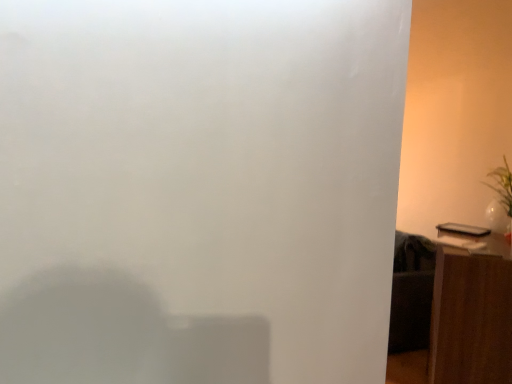
Measure the distance between brown wood side table at right and camera.

brown wood side table at right is 6.31 feet away from camera.

The width and height of the screenshot is (512, 384). What do you see at coordinates (470, 319) in the screenshot? I see `brown wood side table at right` at bounding box center [470, 319].

Find the location of a particular element. brown wood side table at right is located at coordinates (470, 319).

Image resolution: width=512 pixels, height=384 pixels. Find the location of `white glossy vase at right`. white glossy vase at right is located at coordinates (502, 185).

This screenshot has width=512, height=384. Describe the element at coordinates (502, 185) in the screenshot. I see `white glossy vase at right` at that location.

This screenshot has height=384, width=512. What are the coordinates of `brown wood side table at right` in the screenshot? It's located at (470, 319).

Considering the relative positions of brown wood side table at right and white glossy vase at right in the image provided, is brown wood side table at right to the right of white glossy vase at right from the viewer's perspective?

In fact, brown wood side table at right is to the left of white glossy vase at right.

Relative to white glossy vase at right, is brown wood side table at right in front or behind?

brown wood side table at right is positioned closer to the viewer than white glossy vase at right.

Which is farther, [447,333] or [508,206]?

The point [508,206] is farther from the camera.

From the image's perspective, who appears lower, brown wood side table at right or white glossy vase at right?

brown wood side table at right, from the image's perspective.

From a real-world perspective, who is located lower, brown wood side table at right or white glossy vase at right?

In real-world perspective, brown wood side table at right is lower.

Considering the relative sizes of brown wood side table at right and white glossy vase at right in the image provided, is brown wood side table at right thinner than white glossy vase at right?

No.

Which of these two, brown wood side table at right or white glossy vase at right, stands shorter?

With less height is white glossy vase at right.

Considering the sizes of objects brown wood side table at right and white glossy vase at right in the image provided, who is smaller, brown wood side table at right or white glossy vase at right?

white glossy vase at right is smaller.

Can white glossy vase at right be found inside brown wood side table at right?

Actually, white glossy vase at right is outside brown wood side table at right.

Is brown wood side table at right positioned far away from white glossy vase at right?

That's not correct — brown wood side table at right is a little close to white glossy vase at right.

Could you tell me if brown wood side table at right is turned towards white glossy vase at right?

No, brown wood side table at right is not aimed at white glossy vase at right.

Measure the distance from brown wood side table at right to white glossy vase at right.

brown wood side table at right and white glossy vase at right are 60.16 centimeters apart.

I want to click on furniture in front of the white glossy vase at right, so click(x=470, y=319).

Looking at this image, which is more to the right, white glossy vase at right or brown wood side table at right?

Positioned to the right is white glossy vase at right.

Which object is more forward, white glossy vase at right or brown wood side table at right?

brown wood side table at right is more forward.

Considering the points (498, 169) and (481, 332), which point is behind, point (498, 169) or point (481, 332)?

Point (498, 169)

From the image's perspective, does white glossy vase at right appear higher than brown wood side table at right?

Yes, from the image's perspective, white glossy vase at right is over brown wood side table at right.

From the picture: From a real-world perspective, relative to brown wood side table at right, is white glossy vase at right vertically above or below?

white glossy vase at right is situated higher than brown wood side table at right in the real world.

Does white glossy vase at right have a lesser width compared to brown wood side table at right?

Yes, white glossy vase at right is thinner than brown wood side table at right.

Is white glossy vase at right taller than brown wood side table at right?

Incorrect, the height of white glossy vase at right is not larger of that of brown wood side table at right.

Considering the sizes of objects white glossy vase at right and brown wood side table at right in the image provided, who is smaller, white glossy vase at right or brown wood side table at right?

With smaller size is white glossy vase at right.

Is brown wood side table at right surrounded by white glossy vase at right?

No, brown wood side table at right is not inside white glossy vase at right.

Can you see white glossy vase at right touching brown wood side table at right?

No, white glossy vase at right is not with brown wood side table at right.

Is white glossy vase at right oriented towards brown wood side table at right?

No, white glossy vase at right is not aimed at brown wood side table at right.

Measure the distance between white glossy vase at right and brown wood side table at right.

A distance of 60.16 centimeters exists between white glossy vase at right and brown wood side table at right.

You are a GUI agent. You are given a task and a screenshot of the screen. Output one action in this format:
    pyautogui.click(x=<x>, y=<y>)
    Task: Click on the furniture that appears on the left of white glossy vase at right
    
    Given the screenshot: What is the action you would take?
    pyautogui.click(x=470, y=319)

In the image, there is a white glossy vase at right. Identify the location of furniture below it (from the image's perspective). The image size is (512, 384). (470, 319).

In order to click on plant on the right of brown wood side table at right in this screenshot , I will do `click(502, 185)`.